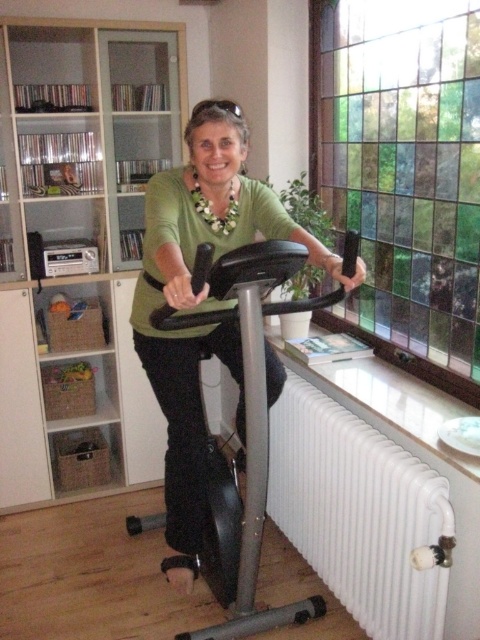
You are standing in the room and want to place a small plant between the two points, point (48, 344) and point (359, 531). Which point should the plant be closer to so it is nearer to the viewer?

The plant should be placed closer to point (48, 344) because it is closer to the viewer than point (359, 531).

You are trying to place a new book on the white glossy bookshelf at left. However, you notice that the white matte radiator at lower right is blocking your access. Can you move the bookshelf to the right to avoid the radiator?

The white matte radiator at lower right is behind the white glossy bookshelf at left, so moving the bookshelf to the right would not avoid the radiator since it is already positioned to the left of the radiator.

You are a delivery person who needs to place a large package on the white glossy bookshelf at left. The package is too heavy to lift over your head. Can you place the package directly in front of the green matte shirt at center without moving the shirt?

The white glossy bookshelf at left is located above the green matte shirt at center, so you can place the package directly in front of the green matte shirt at center since the bookshelf is above it and the package can be placed on the shelf without disturbing the shirt.